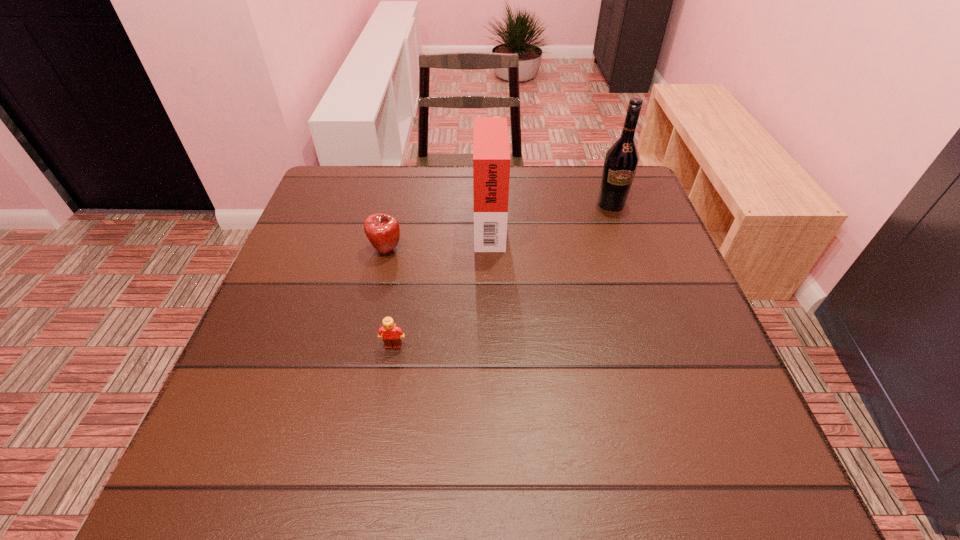
Where is `vacant space located on the face of the shortest object`? vacant space located on the face of the shortest object is located at coordinates point(376,447).

The height and width of the screenshot is (540, 960). Find the location of `wine bottle positioned at the far edge`. wine bottle positioned at the far edge is located at coordinates (622, 158).

You are a GUI agent. You are given a task and a screenshot of the screen. Output one action in this format:
    pyautogui.click(x=<x>, y=<y>)
    Task: Click on the cigarette case that is at the far edge
    The image size is (960, 540).
    Given the screenshot: What is the action you would take?
    pyautogui.click(x=491, y=154)

Identify the location of object at the right edge. (622, 158).

Locate an element on the screen. object that is at the far right corner is located at coordinates 622,158.

Find the location of a particular element. The width and height of the screenshot is (960, 540). vacant space at the far edge of the desktop is located at coordinates (449, 202).

The height and width of the screenshot is (540, 960). I want to click on free region at the near edge, so click(564, 474).

Image resolution: width=960 pixels, height=540 pixels. Identify the location of free point at the left edge. (338, 276).

Identify the location of vacant space at the right edge of the desktop. Image resolution: width=960 pixels, height=540 pixels. (637, 340).

The width and height of the screenshot is (960, 540). I want to click on vacant region at the far left corner, so click(331, 204).